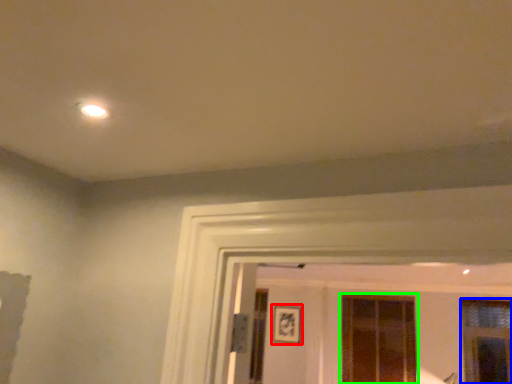
Question: Based on their relative distances, which object is farther from picture frame (highlighted by a red box)? Choose from window (highlighted by a blue box) and window (highlighted by a green box).

Choices:
 (A) window
 (B) window

Answer: (A)